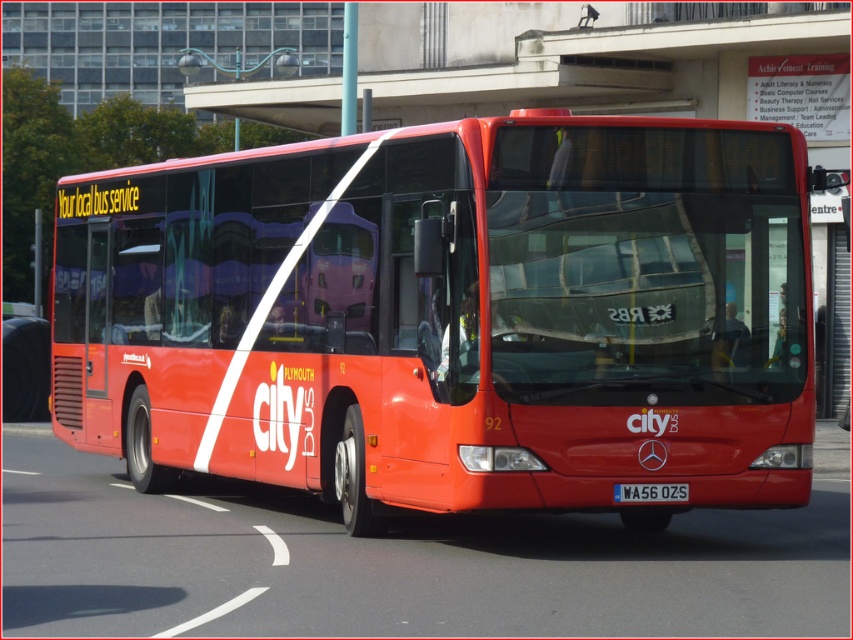
The width and height of the screenshot is (853, 640). I want to click on shiny red bus at center, so click(x=451, y=316).

From the picture: Between shiny red bus at center and white plastic license plate at center, which one has less height?

With less height is white plastic license plate at center.

Measure the distance between shiny red bus at center and camera.

shiny red bus at center is 29.61 feet away from camera.

Image resolution: width=853 pixels, height=640 pixels. I want to click on shiny red bus at center, so click(451, 316).